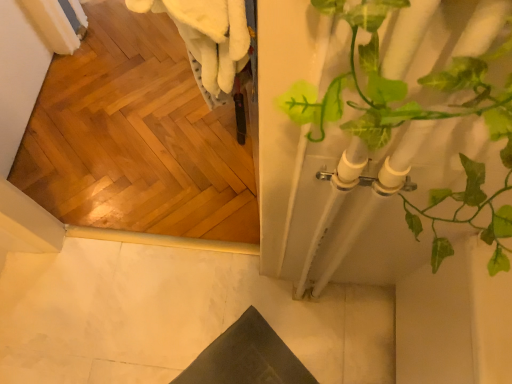
Question: Is green leafy plant at right bigger than white marble floor at lower left?

Choices:
 (A) no
 (B) yes

Answer: (B)

Question: Is green leafy plant at right outside of white marble floor at lower left?

Choices:
 (A) no
 (B) yes

Answer: (B)

Question: Is green leafy plant at right further to camera compared to white marble floor at lower left?

Choices:
 (A) yes
 (B) no

Answer: (B)

Question: Does green leafy plant at right lie in front of white marble floor at lower left?

Choices:
 (A) yes
 (B) no

Answer: (A)

Question: From a real-world perspective, is green leafy plant at right on top of white marble floor at lower left?

Choices:
 (A) no
 (B) yes

Answer: (B)

Question: Is white marble floor at lower left inside green leafy plant at right?

Choices:
 (A) no
 (B) yes

Answer: (A)

Question: Is green leafy plant at right at the back of white marble floor at lower left?

Choices:
 (A) no
 (B) yes

Answer: (A)

Question: Does white marble floor at lower left touch green leafy plant at right?

Choices:
 (A) yes
 (B) no

Answer: (B)

Question: Does white marble floor at lower left have a greater width compared to green leafy plant at right?

Choices:
 (A) yes
 (B) no

Answer: (A)

Question: Is white marble floor at lower left oriented towards green leafy plant at right?

Choices:
 (A) no
 (B) yes

Answer: (A)

Question: Considering the relative sizes of white marble floor at lower left and green leafy plant at right in the image provided, is white marble floor at lower left taller than green leafy plant at right?

Choices:
 (A) no
 (B) yes

Answer: (A)

Question: Is white marble floor at lower left completely or partially outside of green leafy plant at right?

Choices:
 (A) yes
 (B) no

Answer: (A)

Question: Would you say white marble floor at lower left is inside or outside green leafy plant at right?

Choices:
 (A) outside
 (B) inside

Answer: (A)